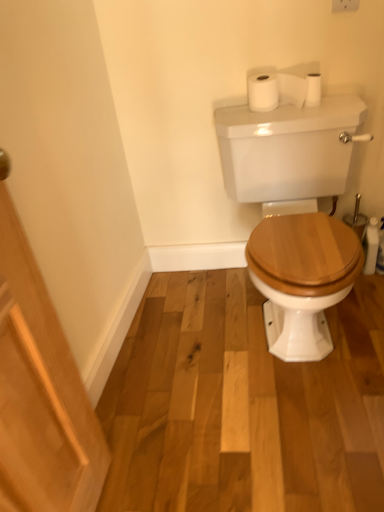
This screenshot has width=384, height=512. I want to click on free spot below white glossy porcelain at center (from a real-world perspective), so click(x=266, y=324).